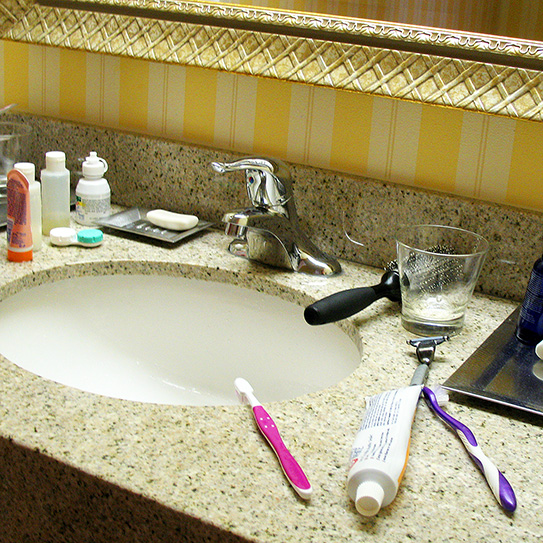
Identify the location of cosmetic bottles. This screenshot has height=543, width=543. (22, 218), (35, 195), (47, 195).